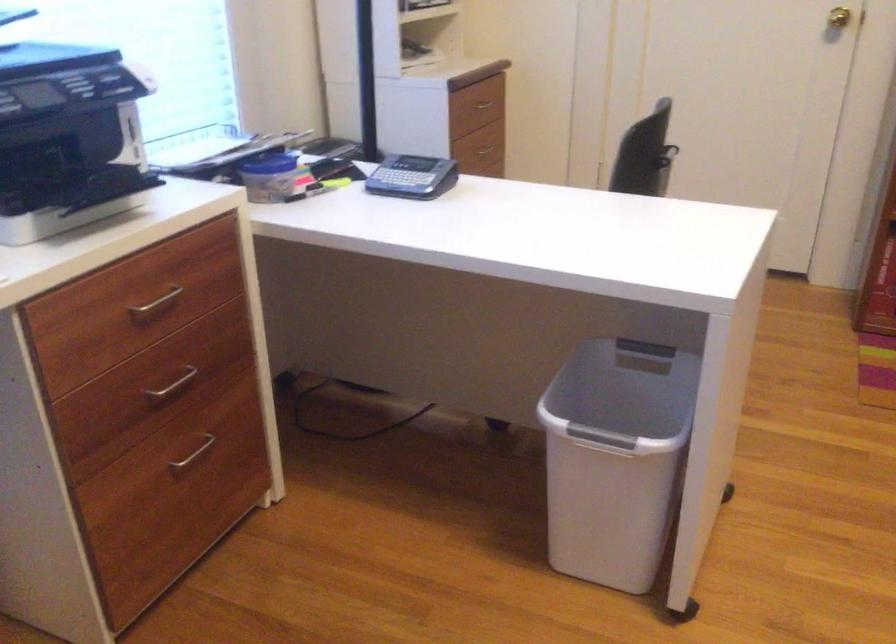
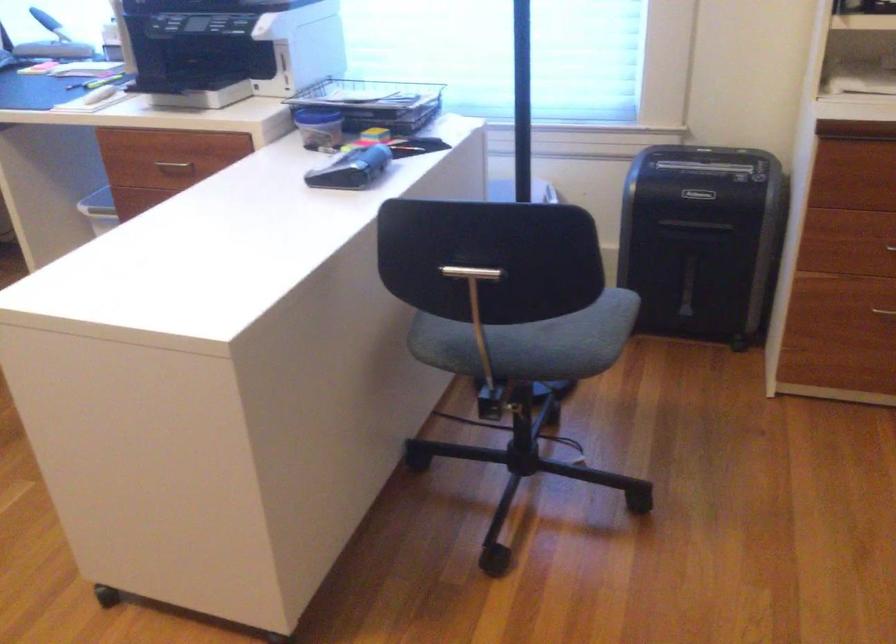
In the second image, find the point that corresponds to (x=260, y=149) in the first image.

(374, 102)